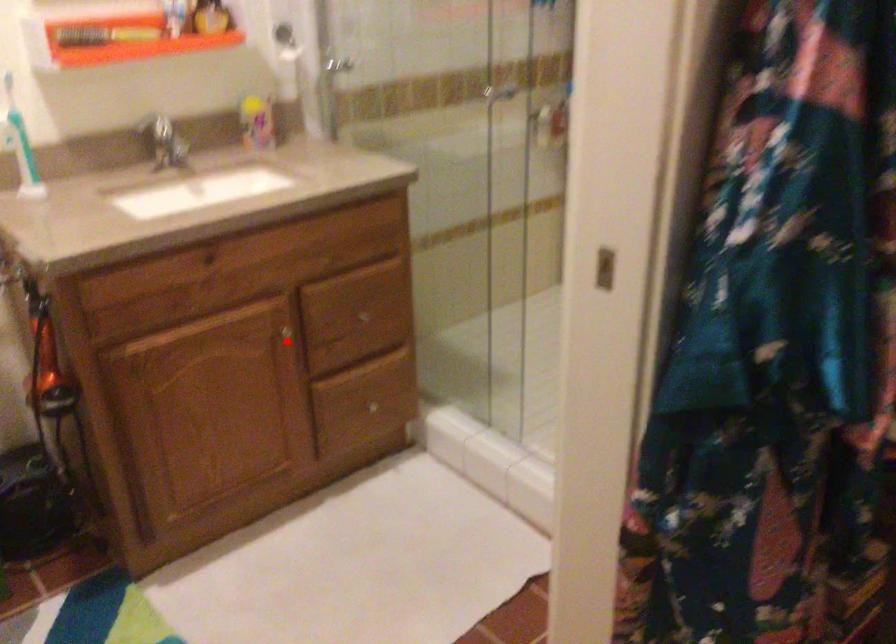
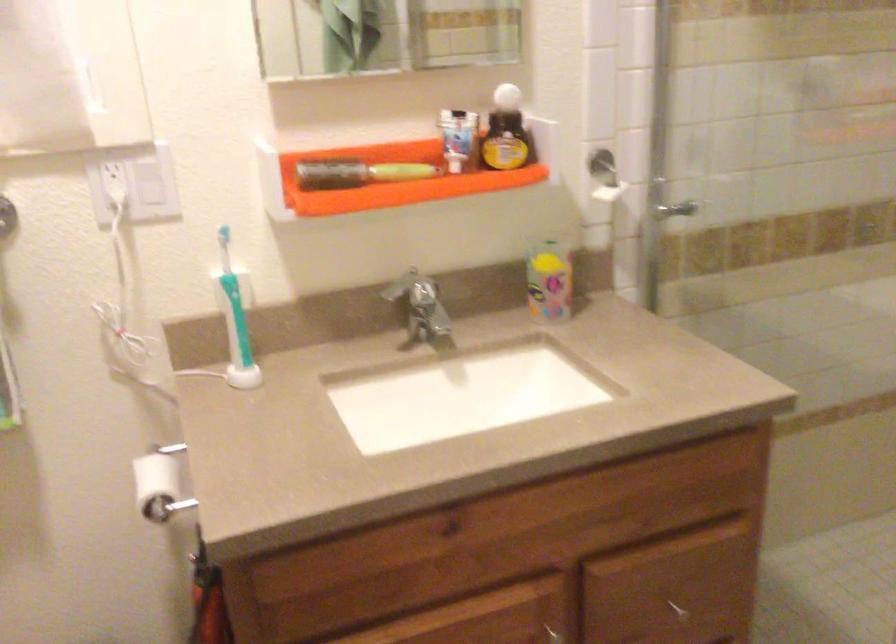
Question: I am providing you with two images of the same scene from different viewpoints. In image1, a red point is highlighted. Considering the same 3D point in image2, which of the following is correct?

Choices:
 (A) It is closer
 (B) It is farther

Answer: (A)